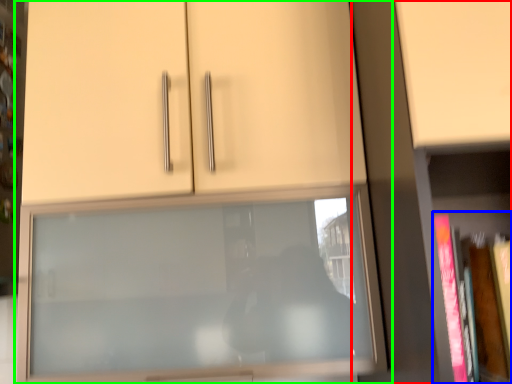
Question: Estimate the real-world distances between objects in this image. Which object is farther from bookcase (highlighted by a red box), book (highlighted by a blue box) or cupboard (highlighted by a green box)?

Choices:
 (A) book
 (B) cupboard

Answer: (B)